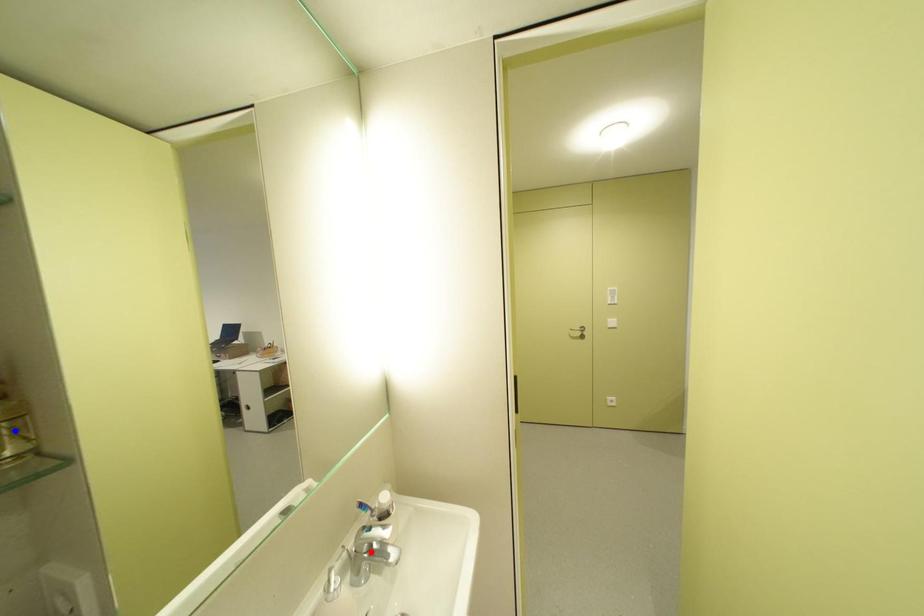
Question: In the image, two points are highlighted. Which point is nearer to the camera? Reply with the corresponding letter.

Choices:
 (A) blue point
 (B) red point

Answer: (A)